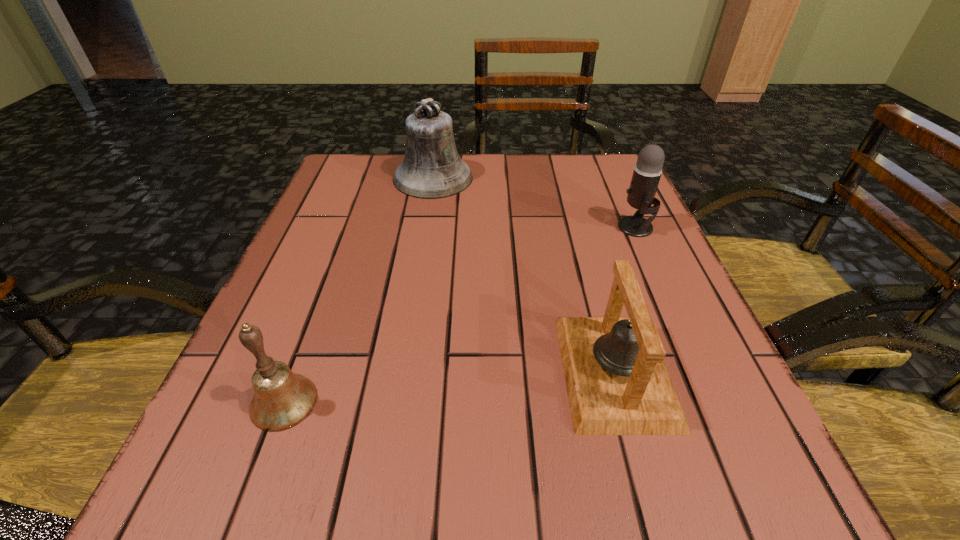
Locate an element on the screen. This screenshot has width=960, height=540. object located at the far edge is located at coordinates (432, 168).

Locate an element on the screen. The height and width of the screenshot is (540, 960). microphone that is at the right edge is located at coordinates (647, 171).

Find the location of `bell that is at the right edge`. bell that is at the right edge is located at coordinates (617, 383).

The image size is (960, 540). I want to click on object located at the far left corner, so click(x=432, y=168).

In order to click on vacant area at the near edge in this screenshot , I will do `click(394, 472)`.

This screenshot has width=960, height=540. I want to click on vacant space at the left edge of the desktop, so click(333, 315).

Locate an element on the screen. This screenshot has height=540, width=960. free space at the right edge of the desktop is located at coordinates (720, 442).

The width and height of the screenshot is (960, 540). In the image, there is a desktop. Identify the location of vacant space at the far left corner. (362, 166).

Locate an element on the screen. Image resolution: width=960 pixels, height=540 pixels. vacant space at the near left corner is located at coordinates (282, 501).

Where is `vacant space at the far right corner of the desktop`? The height and width of the screenshot is (540, 960). vacant space at the far right corner of the desktop is located at coordinates (564, 156).